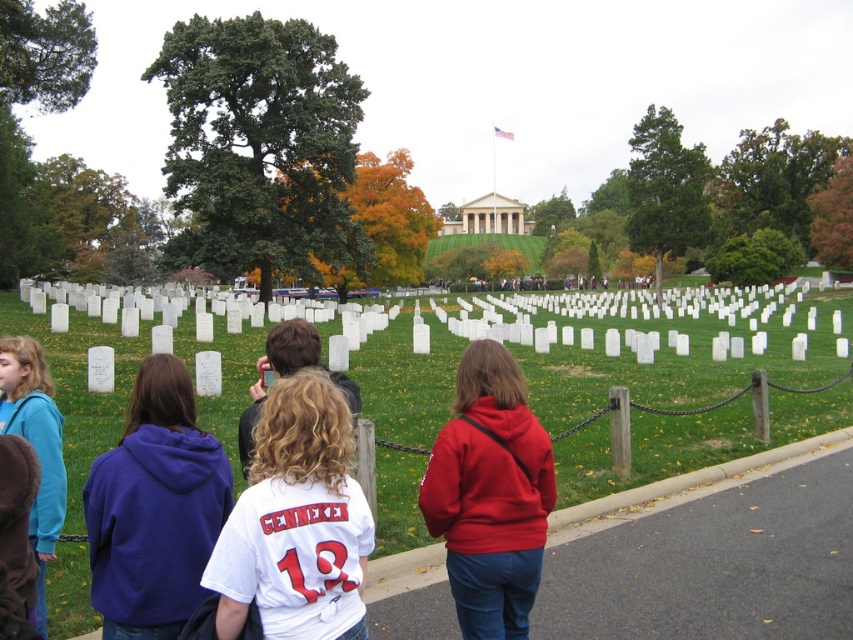
Question: Is blue fleece jacket at lower left further to the viewer compared to curly blonde hair at center?

Choices:
 (A) yes
 (B) no

Answer: (B)

Question: Which of the following is the farthest from the observer?

Choices:
 (A) (138, 524)
 (B) (473, 396)
 (C) (248, 413)
 (D) (633, 420)

Answer: (D)

Question: Where is white matte t-shirt at center located in relation to purple hoodie at center in the image?

Choices:
 (A) below
 (B) above

Answer: (B)

Question: Which point appears farthest from the camera in this image?

Choices:
 (A) (250, 449)
 (B) (456, 410)

Answer: (A)

Question: Does white matte t-shirt at center have a larger size compared to curly blonde hair at center?

Choices:
 (A) no
 (B) yes

Answer: (B)

Question: Which object is positioned farthest from the red matte hoodie at center?

Choices:
 (A) blue fleece jacket at lower left
 (B) purple hoodie at center
 (C) white matte gravestones at center
 (D) white matte t-shirt at center

Answer: (C)